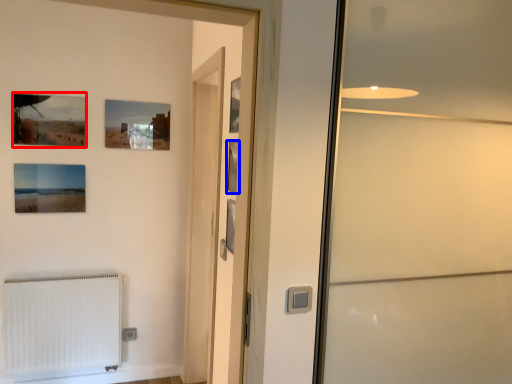
Question: Which point is further to the camera, picture frame (highlighted by a red box) or picture frame (highlighted by a blue box)?

Choices:
 (A) picture frame
 (B) picture frame

Answer: (A)